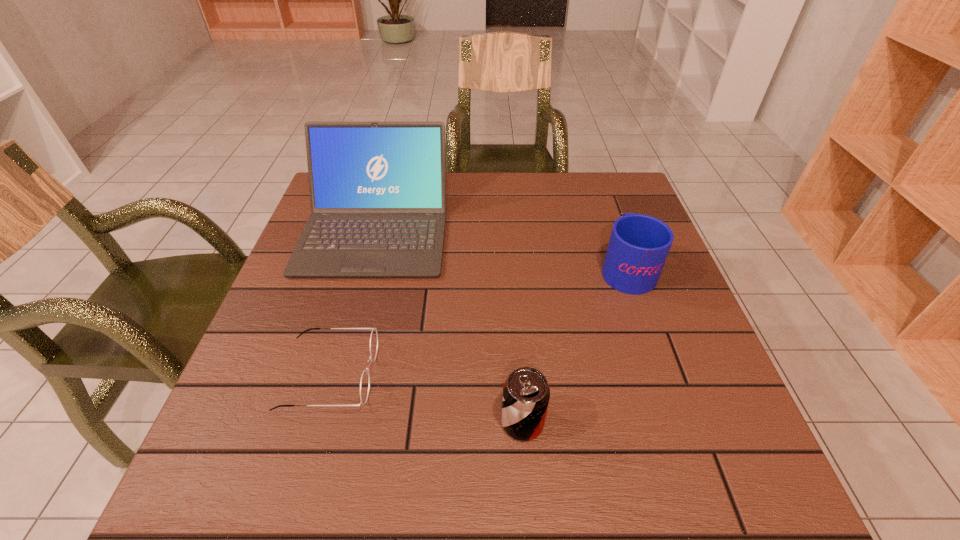
You are a GUI agent. You are given a task and a screenshot of the screen. Output one action in this format:
    pyautogui.click(x=<x>, y=<y>)
    Task: Click on the tallest object
    This screenshot has width=960, height=540.
    Given the screenshot: What is the action you would take?
    pyautogui.click(x=378, y=189)

The height and width of the screenshot is (540, 960). In order to click on the rightmost object in this screenshot , I will do `click(639, 244)`.

Where is `soda can`? This screenshot has height=540, width=960. soda can is located at coordinates (526, 393).

I want to click on spectacles, so click(x=365, y=378).

At what (x,y) coordinates should I click in order to perform the action: click on vacant space located 0.290m on the screen of the tallest object. Please return your answer as a coordinate pair (x, y). Image resolution: width=960 pixels, height=540 pixels. Looking at the image, I should click on (332, 388).

Find the location of a particular element. The width and height of the screenshot is (960, 540). free space located 0.290m on the side with the handle of the rightmost object is located at coordinates (596, 183).

At what (x,y) coordinates should I click in order to perform the action: click on free region located 0.200m on the side with the handle of the rightmost object. Please return your answer as a coordinate pair (x, y). Image resolution: width=960 pixels, height=540 pixels. Looking at the image, I should click on (603, 200).

Image resolution: width=960 pixels, height=540 pixels. In order to click on free space located on the side with the handle of the rightmost object in this screenshot , I will do `click(604, 204)`.

Locate an element on the screen. The width and height of the screenshot is (960, 540). vacant space located 0.360m on the left of the soda can is located at coordinates click(296, 422).

Where is `free point located 0.390m on the front-facing side of the shortest object`? The height and width of the screenshot is (540, 960). free point located 0.390m on the front-facing side of the shortest object is located at coordinates (579, 374).